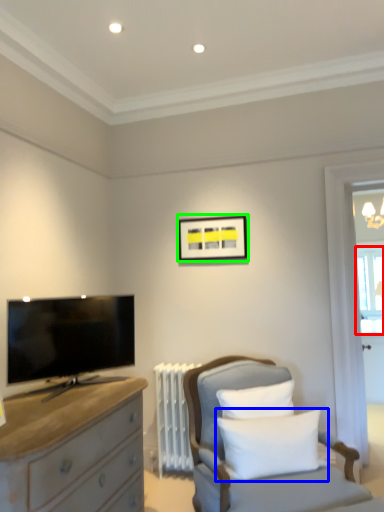
Question: Which object is positioned closest to window screen (highlighted by a red box)? Select from pillow (highlighted by a blue box) and picture frame (highlighted by a green box).

Choices:
 (A) pillow
 (B) picture frame

Answer: (B)